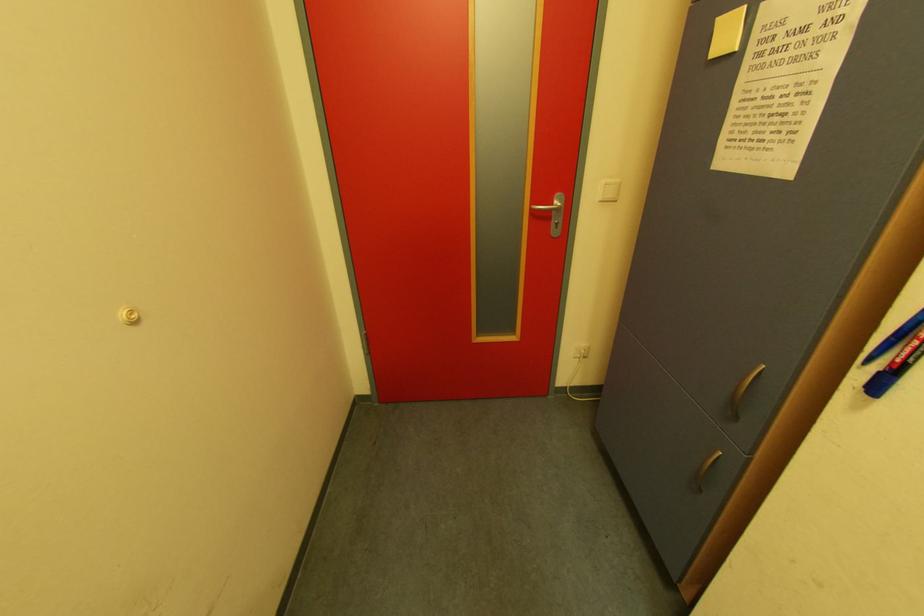
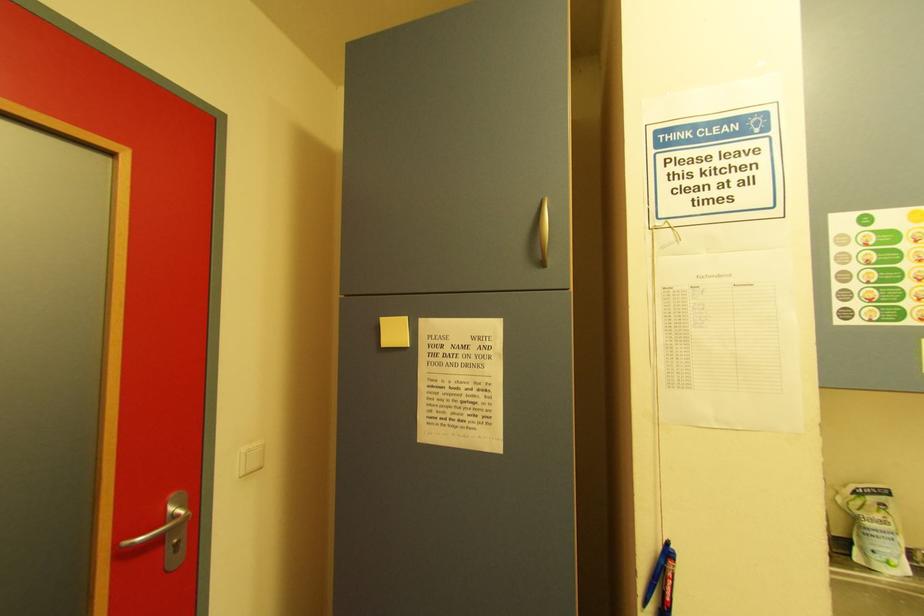
Question: Based on the continuous images, in which direction is the camera rotating? Reply with the corresponding letter.

Choices:
 (A) Left
 (B) Right
 (C) Up
 (D) Down

Answer: (B)